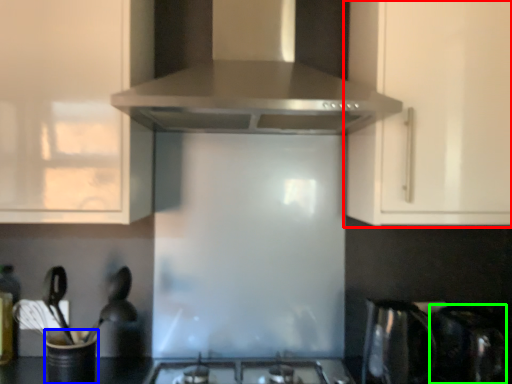
Question: Based on their relative distances, which object is farther from cabinetry (highlighted by a red box)? Choose from appliance (highlighted by a blue box) and appliance (highlighted by a green box).

Choices:
 (A) appliance
 (B) appliance

Answer: (A)